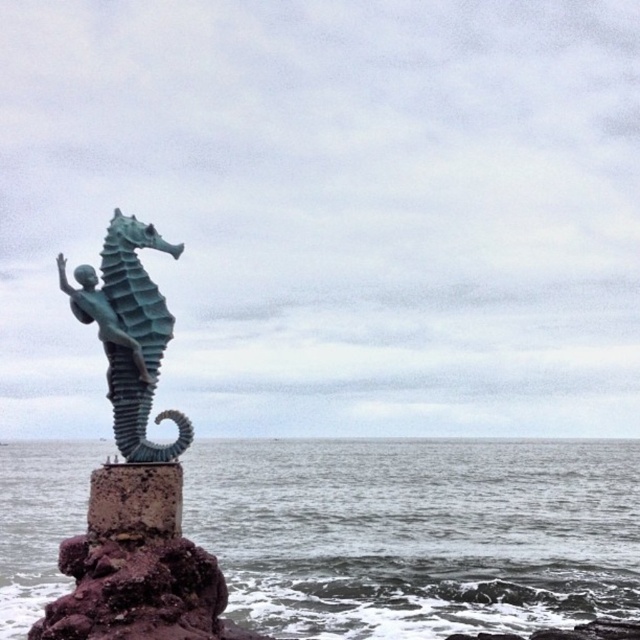
Can you confirm if gray water at sea left is bigger than green patina seahorse at center?

Correct, gray water at sea left is larger in size than green patina seahorse at center.

Which is above, gray water at sea left or green patina seahorse at center?

Positioned higher is green patina seahorse at center.

You are a GUI agent. You are given a task and a screenshot of the screen. Output one action in this format:
    pyautogui.click(x=<x>, y=<y>)
    Task: Click on the gray water at sea left
    The width and height of the screenshot is (640, 640).
    Given the screenshot: What is the action you would take?
    pyautogui.click(x=417, y=532)

Find the location of a particular element. This screenshot has width=640, height=640. gray water at sea left is located at coordinates (417, 532).